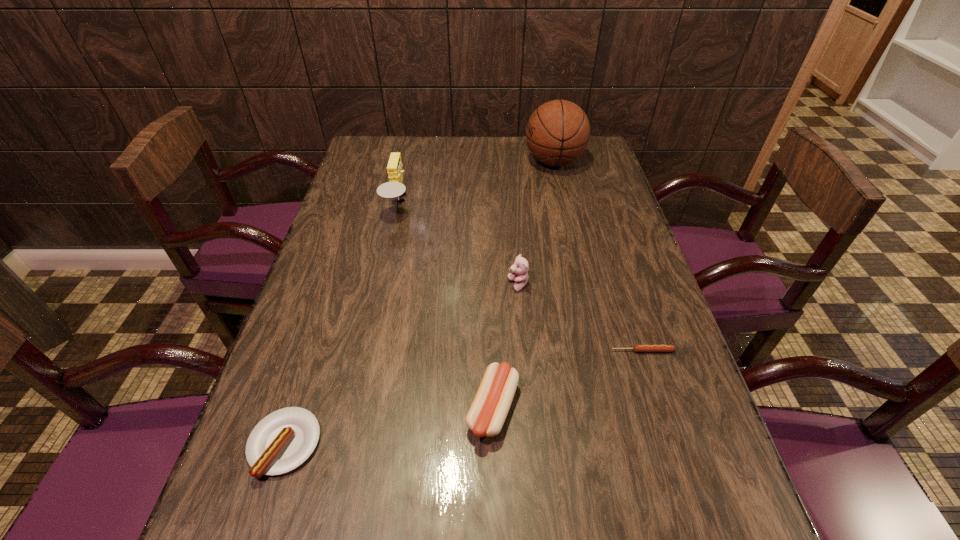
You are a GUI agent. You are given a task and a screenshot of the screen. Output one action in this format:
    pyautogui.click(x=<x>, y=<y>)
    Task: Click on the basketball
    The height and width of the screenshot is (540, 960).
    Given the screenshot: What is the action you would take?
    pyautogui.click(x=557, y=133)

At what (x,y) coordinates should I click in order to perform the action: click on the farthest object. Please return your answer as a coordinate pair (x, y). The width and height of the screenshot is (960, 540). Looking at the image, I should click on (557, 133).

You are a GUI agent. You are given a task and a screenshot of the screen. Output one action in this format:
    pyautogui.click(x=<x>, y=<y>)
    Task: Click on the second tallest object
    
    Given the screenshot: What is the action you would take?
    pyautogui.click(x=394, y=188)

Locate an element on the screen. The width and height of the screenshot is (960, 540). the fifth object from right to left is located at coordinates (394, 188).

This screenshot has height=540, width=960. I want to click on the fourth nearest object, so click(519, 270).

This screenshot has height=540, width=960. I want to click on the fourth shortest object, so click(519, 270).

Identify the location of the third shortest object. The width and height of the screenshot is (960, 540). (486, 416).

Locate an element on the screen. Image resolution: width=960 pixels, height=540 pixels. the second sausage from right to left is located at coordinates (486, 416).

Image resolution: width=960 pixels, height=540 pixels. In order to click on the leftmost sausage in this screenshot , I will do `click(283, 440)`.

The image size is (960, 540). In order to click on the second shortest sausage in this screenshot , I will do click(283, 440).